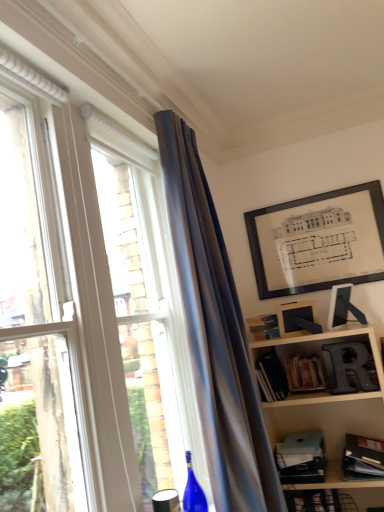
Question: Considering the positions of matte glass window at left and hardcover book at center-right, which is the 1th book from left to right, in the image, is matte glass window at left taller or shorter than hardcover book at center-right, which is the 1th book from left to right,?

Choices:
 (A) short
 (B) tall

Answer: (B)

Question: Considering the positions of point (185, 16) and point (281, 380), is point (185, 16) closer or farther from the camera than point (281, 380)?

Choices:
 (A) farther
 (B) closer

Answer: (B)

Question: Which is farther from the hardcover book at lower right, the first book from the right?

Choices:
 (A) metallic silver letter r at lower right
 (B) silky blue curtain at upper center
 (C) matte glass window at left
 (D) blue glass wine bottle at lower center
 (E) matte blue paperback book at lower right, which ranks as the second paperback book in top-to-bottom order

Answer: (C)

Question: Considering the real-world distances, which object is farthest from the matte blue paperback book at lower right, which ranks as the second paperback book in top-to-bottom order?

Choices:
 (A) blue glass wine bottle at lower center
 (B) hardcover book at center, arranged as the 1th paperback book when viewed from the top
 (C) silky blue curtain at upper center
 (D) hardcover books at lower right, which is counted as the 3th book, starting from the bottom
 (E) hardcover book at center-right, which is the 1th book from left to right

Answer: (C)